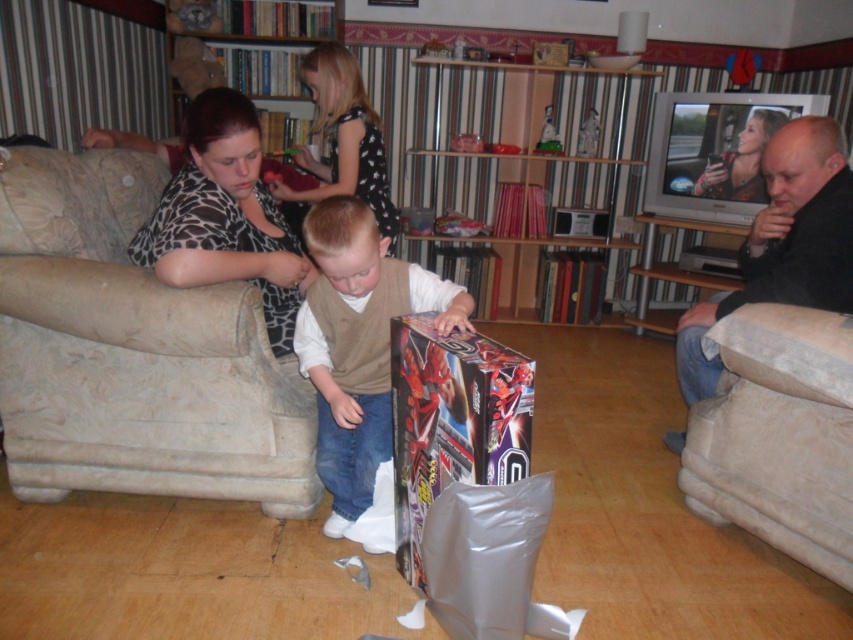
Question: From the image, what is the correct spatial relationship of shiny metallic box at center in relation to black dotted dress at upper center?

Choices:
 (A) below
 (B) above

Answer: (A)

Question: Considering the real-world distances, which object is closest to the beige fabric armchair at left?

Choices:
 (A) beige fabric armchair at right
 (B) wooden bookshelf at center

Answer: (A)

Question: Which of the following is the farthest from the observer?

Choices:
 (A) beige fabric armchair at right
 (B) blonde hair at upper center
 (C) beige fabric armchair at left

Answer: (B)

Question: Which point is closer to the camera?

Choices:
 (A) beige fabric armchair at left
 (B) blonde hair at upper center
 (C) black dotted dress at upper center
 (D) wooden bookshelf at center

Answer: (A)

Question: Does beige fabric armchair at right have a smaller size compared to blonde hair at upper center?

Choices:
 (A) no
 (B) yes

Answer: (A)

Question: Observing the image, what is the correct spatial positioning of beige fabric armchair at right in reference to wooden bookshelf at upper center?

Choices:
 (A) above
 (B) below

Answer: (B)